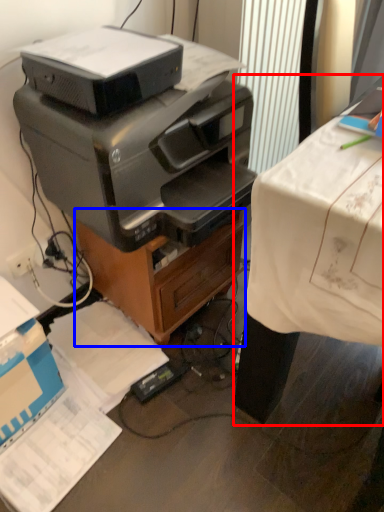
Question: Which of the following is the closest to the observer, desk (highlighted by a red box) or file cabinet (highlighted by a blue box)?

Choices:
 (A) desk
 (B) file cabinet

Answer: (A)